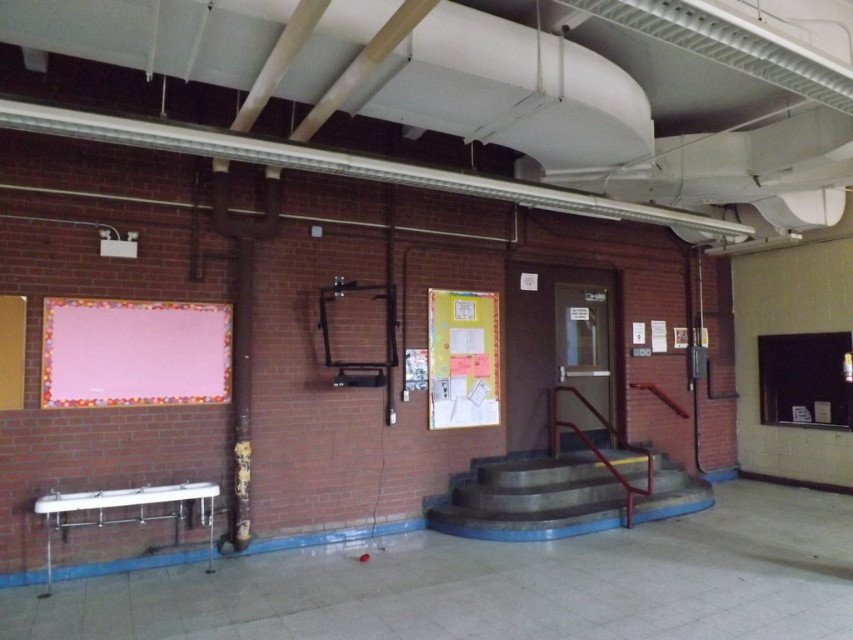
Which is below, pink fabric board at left or yellow paperboard bulletin board at center?

Positioned lower is yellow paperboard bulletin board at center.

Where is `pink fabric board at left`? pink fabric board at left is located at coordinates (134, 353).